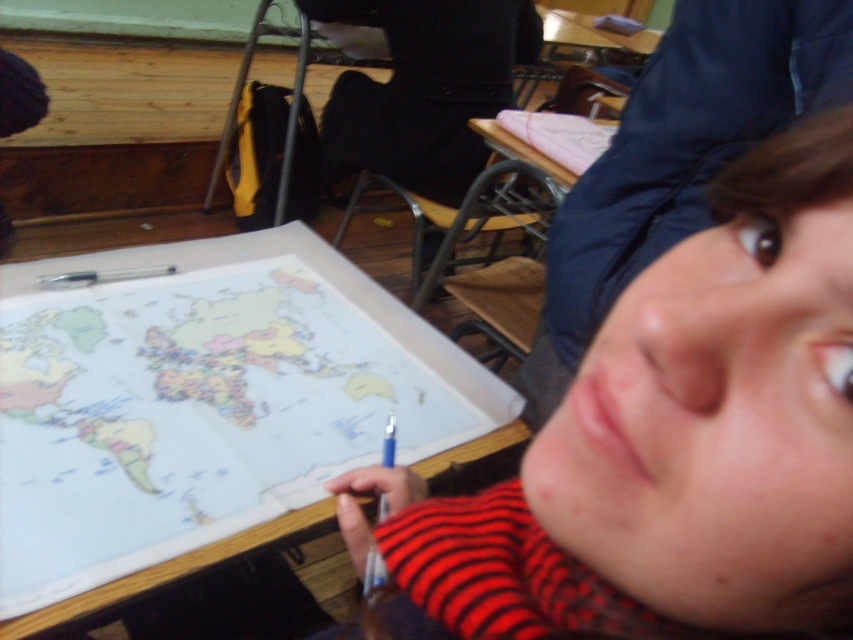
Question: Which of the following is the closest to the observer?

Choices:
 (A) (213, 246)
 (B) (573, 412)
 (C) (668, 136)

Answer: (B)

Question: Which object is closer to the camera taking this photo?

Choices:
 (A) smooth skin face at upper right
 (B) wooden table at center

Answer: (A)

Question: Which point is closer to the camera?

Choices:
 (A) (729, 413)
 (B) (473, 444)
 (C) (809, 48)

Answer: (A)

Question: Is smooth skin face at upper right smaller than wooden table at center?

Choices:
 (A) no
 (B) yes

Answer: (B)

Question: Is striped sweater at center bigger than wooden table at center?

Choices:
 (A) yes
 (B) no

Answer: (B)

Question: Observing the image, what is the correct spatial positioning of striped sweater at center in reference to smooth skin face at upper right?

Choices:
 (A) right
 (B) left

Answer: (B)